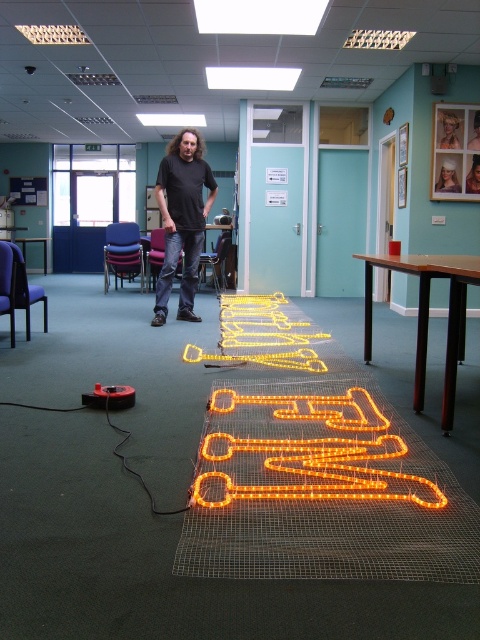
Is orange wire neon sign at center bigger than black matte shirt at center?

Actually, orange wire neon sign at center might be smaller than black matte shirt at center.

Which of these two, orange wire neon sign at center or black matte shirt at center, stands taller?

black matte shirt at center is taller.

Does point (285, 400) come closer to viewer compared to point (178, 179)?

Yes, point (285, 400) is in front of point (178, 179).

Locate an element on the screen. The height and width of the screenshot is (640, 480). orange wire neon sign at center is located at coordinates (313, 452).

Can you confirm if orange wire neon sign at center is shorter than orange led lights at center?

Correct, orange wire neon sign at center is not as tall as orange led lights at center.

The width and height of the screenshot is (480, 640). Describe the element at coordinates (313, 452) in the screenshot. I see `orange wire neon sign at center` at that location.

Is point (289, 480) positioned before point (225, 307)?

Yes, point (289, 480) is closer to viewer.

Where is `orange wire neon sign at center`? orange wire neon sign at center is located at coordinates (313, 452).

Is point (160, 284) closer to viewer compared to point (195, 352)?

No, (160, 284) is further to viewer.

This screenshot has height=640, width=480. I want to click on black matte shirt at center, so click(x=181, y=220).

Locate an element on the screen. The width and height of the screenshot is (480, 640). black matte shirt at center is located at coordinates (x=181, y=220).